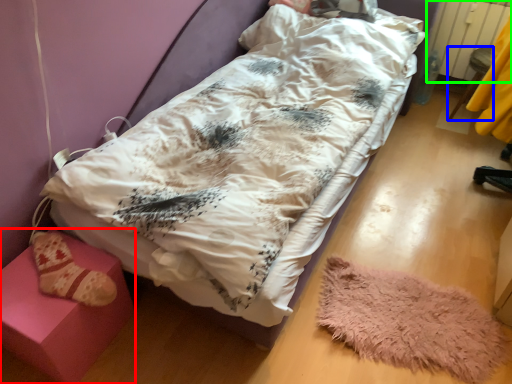
Question: Which object is the farthest from furniture (highlighted by a red box)? Choose among these: furniture (highlighted by a blue box) or radiator (highlighted by a green box).

Choices:
 (A) furniture
 (B) radiator

Answer: (B)